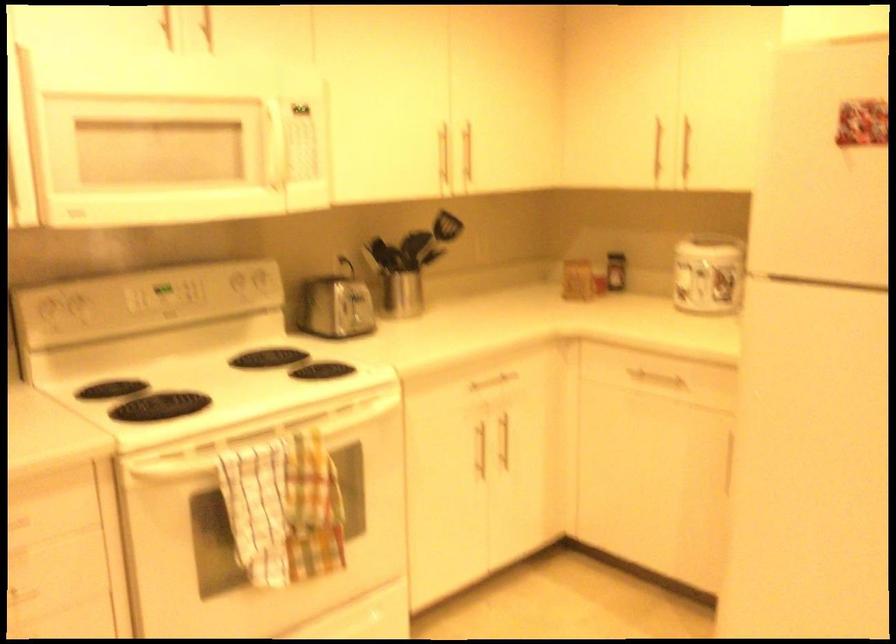
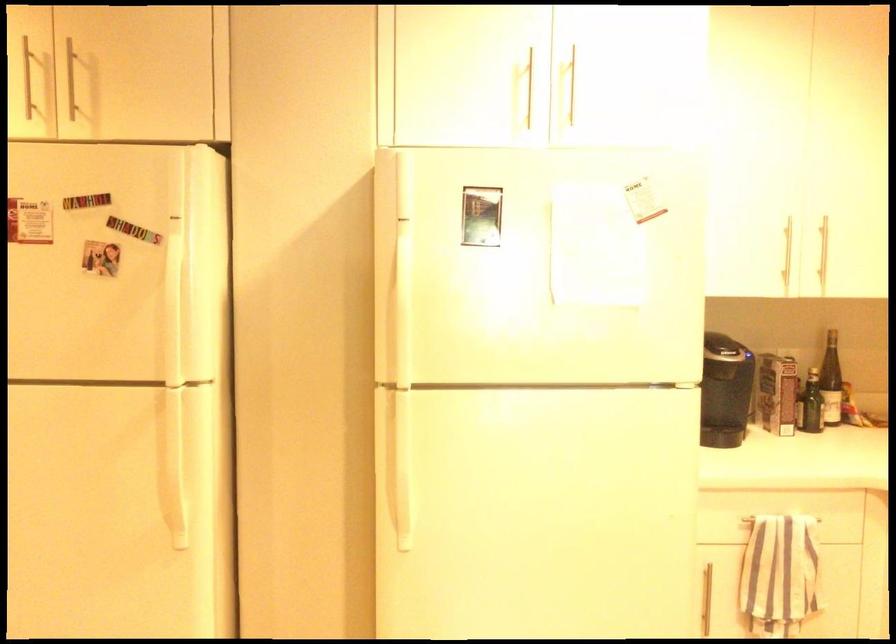
Question: How did the camera likely rotate?

Choices:
 (A) Left
 (B) Right
 (C) Up
 (D) Down

Answer: (B)